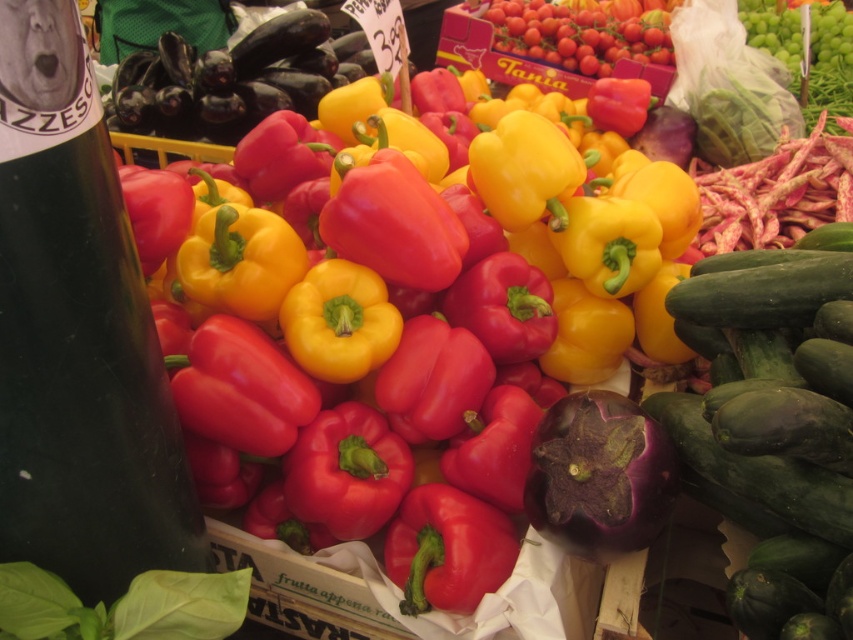
How far apart are shiny red bell pepper at center and green smooth cucumber at right?

14.84 inches

Which is behind, point (643, 216) or point (670, 435)?

Point (643, 216)

Locate an element on the screen. This screenshot has height=640, width=853. shiny red bell pepper at center is located at coordinates (419, 339).